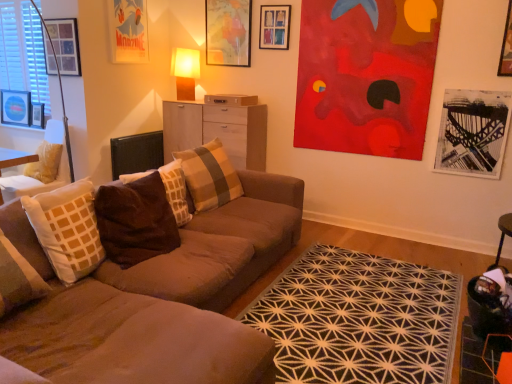
You are a GUI agent. You are given a task and a screenshot of the screen. Output one action in this format:
    pyautogui.click(x=<x>, y=<y>)
    Task: Click on the vacant position to the left of orange fabric swivel chair at lower right
    This screenshot has height=384, width=512.
    Given the screenshot: What is the action you would take?
    pyautogui.click(x=448, y=360)